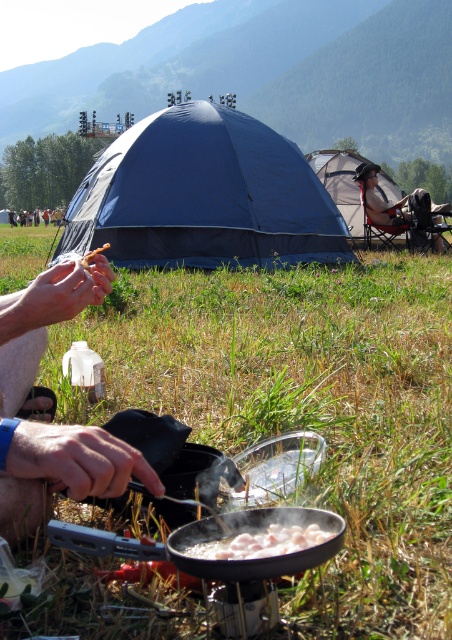
Does blue fabric tent at center have a greater width compared to white glossy meat at center?

Correct, the width of blue fabric tent at center exceeds that of white glossy meat at center.

Who is more distant from viewer, (154, 182) or (310, 541)?

Point (154, 182)

Who is more forward, (163, 188) or (252, 552)?

Point (252, 552) is more forward.

Where is `blue fabric tent at center`? The width and height of the screenshot is (452, 640). blue fabric tent at center is located at coordinates (203, 195).

Which is more to the right, gray fabric tent at center or white glossy meat at center?

gray fabric tent at center is more to the right.

Is gray fabric tent at center to the left of white glossy meat at center from the viewer's perspective?

In fact, gray fabric tent at center is to the right of white glossy meat at center.

Does point (339, 150) lie behind point (216, 548)?

Yes, it is.

This screenshot has width=452, height=640. In order to click on gray fabric tent at center in this screenshot , I will do `click(340, 184)`.

Measure the distance from blue fabric tent at center to gray fabric tent at center.

4.75 meters

In the scene shown: Can you confirm if blue fabric tent at center is thinner than gray fabric tent at center?

No.

Locate an element on the screen. This screenshot has height=640, width=452. blue fabric tent at center is located at coordinates (203, 195).